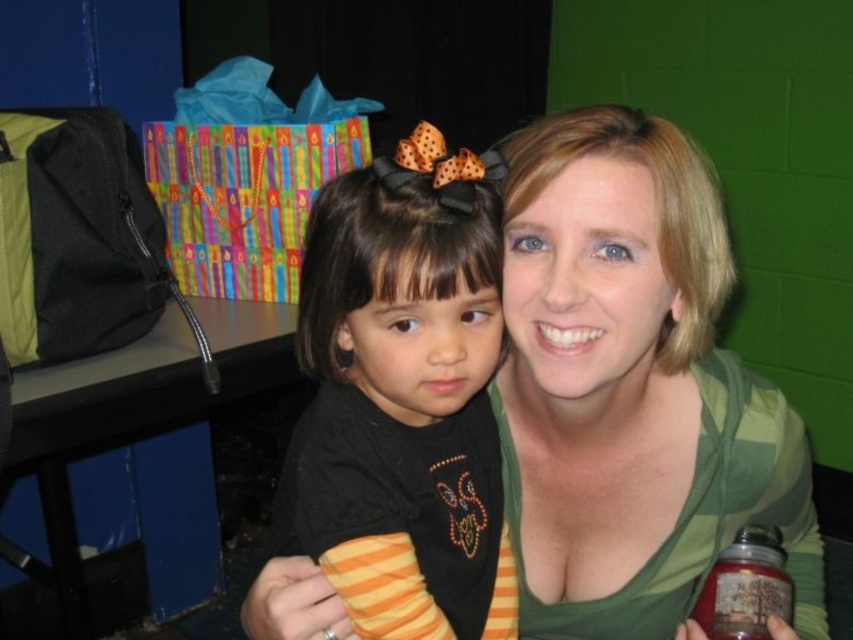
Does point (648, 189) come in front of point (366, 630)?

No, (648, 189) is behind (366, 630).

This screenshot has width=853, height=640. I want to click on green striped shirt at upper center, so click(x=631, y=387).